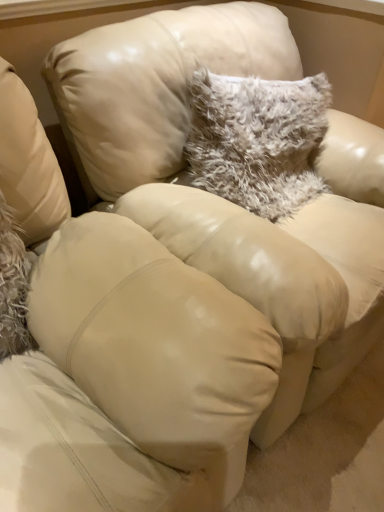
Measure the distance between fuzzy white pillow at upper center and camera.

fuzzy white pillow at upper center is 3.83 feet away from camera.

Where is `fuzzy white pillow at upper center`? This screenshot has height=512, width=384. fuzzy white pillow at upper center is located at coordinates (257, 140).

This screenshot has height=512, width=384. What do you see at coordinates (257, 140) in the screenshot? I see `fuzzy white pillow at upper center` at bounding box center [257, 140].

The width and height of the screenshot is (384, 512). In order to click on fuzzy white pillow at upper center in this screenshot , I will do `click(257, 140)`.